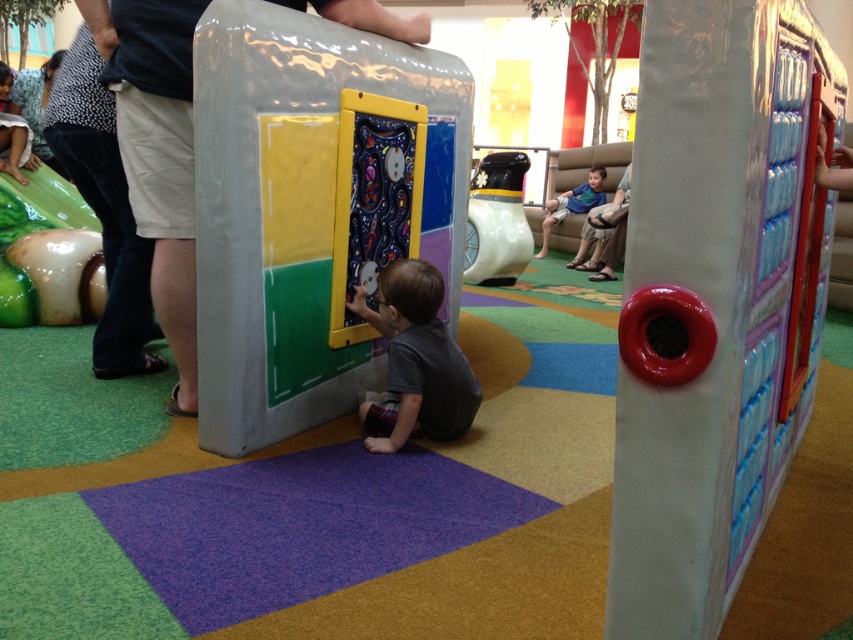
You are a parent trying to locate your child in the play area. You see the smooth plastic door at center and the shiny plastic mushroom at lower left. Which object is nearer to you?

The smooth plastic door at center is closer to the viewer than the shiny plastic mushroom at lower left, so the smooth plastic door at center is nearer to you.

You are a parent trying to decide which toy to let your child play with first. You see the smooth plastic door at center and the shiny plastic mushroom at lower left. Which one is bigger?

The smooth plastic door at center is bigger than the shiny plastic mushroom at lower left.